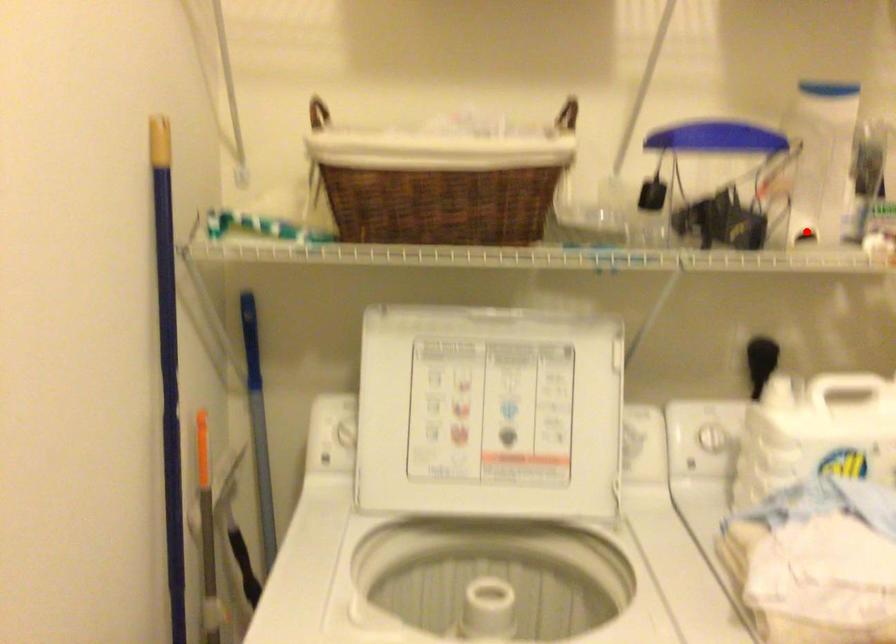
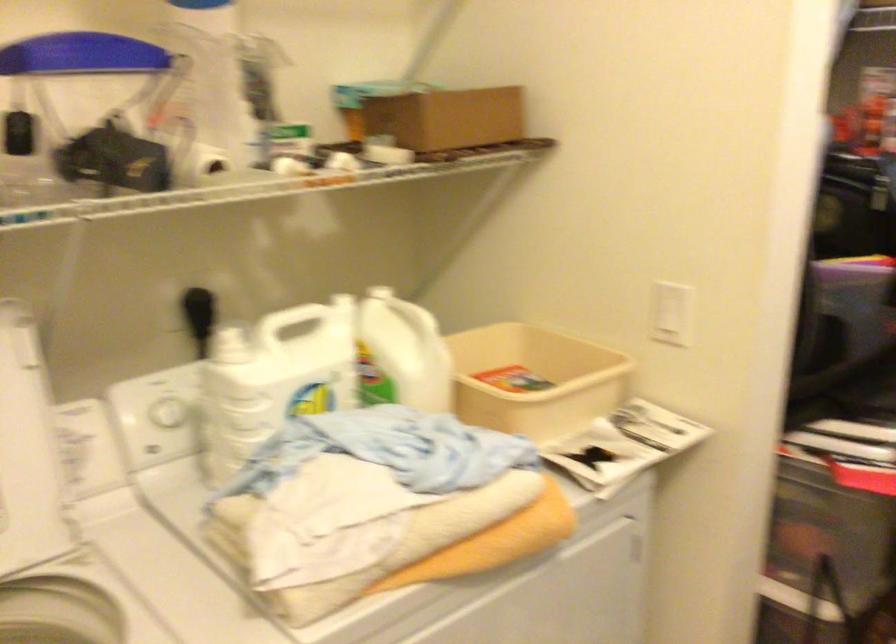
Where in the second image is the point corresponding to the highlighted location from the first image?

(211, 162)